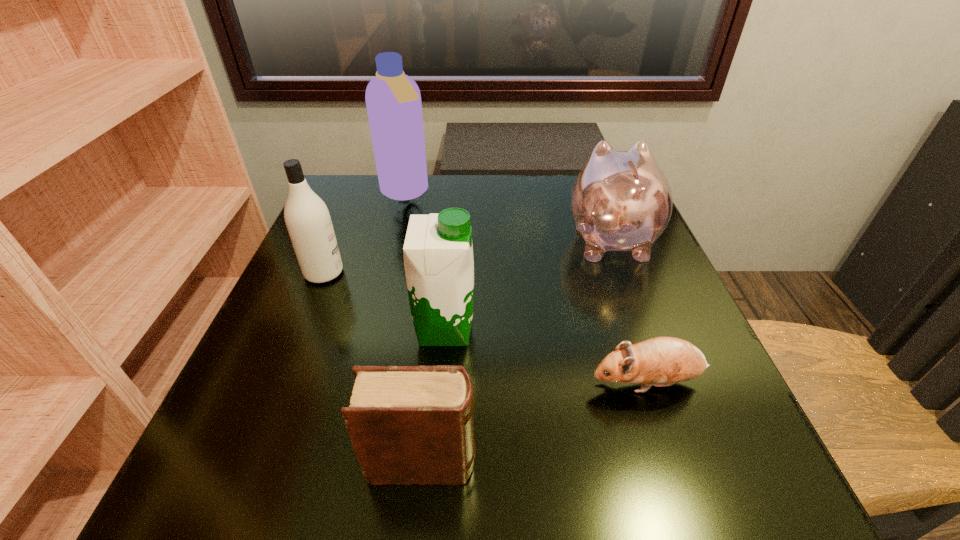
At what (x,y) coordinates should I click in order to perform the action: click on the farther shampoo. Please return your answer as a coordinate pair (x, y). Looking at the image, I should click on (393, 100).

Image resolution: width=960 pixels, height=540 pixels. In order to click on the farthest object in this screenshot , I will do `click(393, 100)`.

Where is `the leftmost object`? the leftmost object is located at coordinates (309, 224).

Locate an element on the screen. the left shampoo is located at coordinates (309, 224).

The width and height of the screenshot is (960, 540). What are the coordinates of `soya milk` in the screenshot? It's located at (438, 253).

Image resolution: width=960 pixels, height=540 pixels. I want to click on piggy bank, so click(x=620, y=201).

Where is `the nearest object`? Image resolution: width=960 pixels, height=540 pixels. the nearest object is located at coordinates (408, 425).

Locate an element on the screen. The height and width of the screenshot is (540, 960). diary is located at coordinates (408, 425).

Where is `the shortest object`? Image resolution: width=960 pixels, height=540 pixels. the shortest object is located at coordinates point(662,361).

This screenshot has width=960, height=540. I want to click on the second nearest object, so click(x=662, y=361).